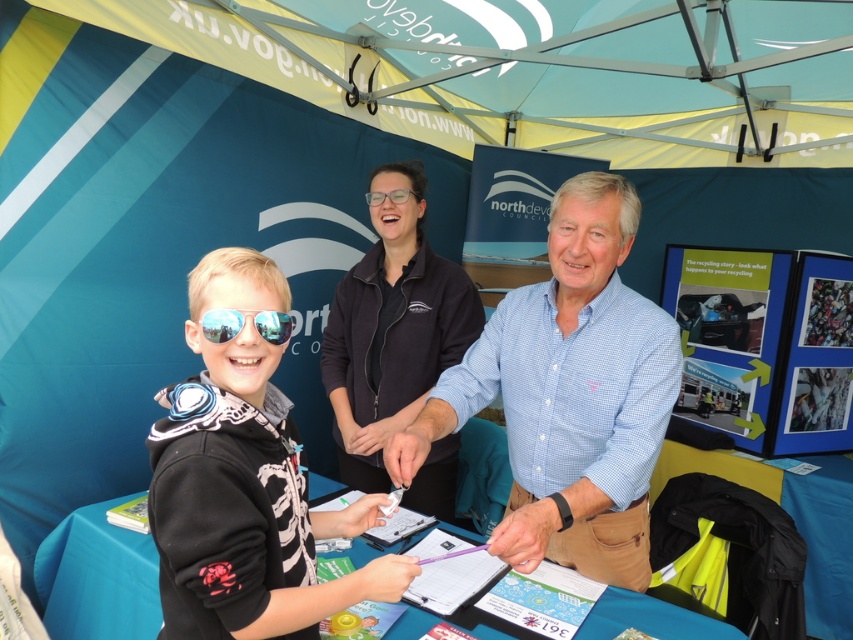
You are a photographer at the event and want to ensure both the black matte hoodie at center and the light blue checkered shirt at center are visible in the photo. Since the shirts are overlapping, which one should you adjust to make sure both are fully visible?

The black matte hoodie at center is thinner than the light blue checkered shirt at center, so you should adjust the black matte hoodie at center to ensure both are visible.

Based on the scene description, which object is positioned lower on the body between the black matte hoodie at center and the light blue checkered shirt at center?

The black matte hoodie at center is positioned lower on the body than the light blue checkered shirt at center.

You are a photographer at the North Devon event and need to capture both the black matte hoodie at center and the light blue checkered shirt at center in a single frame. Which object should you position closer to the left side of your camera frame to ensure both are visible?

To ensure both the black matte hoodie at center and the light blue checkered shirt at center are visible in the frame, position the black matte hoodie at center closer to the left side since it is already to the left of the light blue checkered shirt at center in the scene.